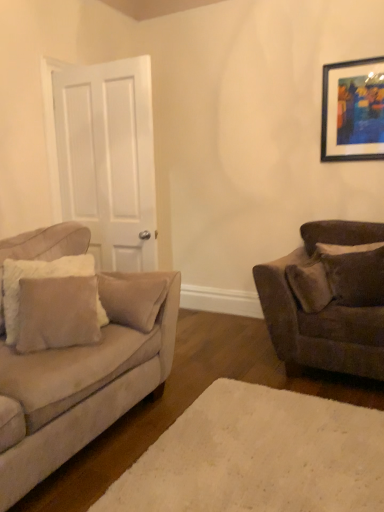
Question: Does suede beige couch at left, which is the first studio couch in left-to-right order, lie in front of velvet brown couch at right, marked as the 1th studio couch in a right-to-left arrangement?

Choices:
 (A) yes
 (B) no

Answer: (A)

Question: Does suede beige couch at left, positioned as the 2th studio couch in right-to-left order, come behind velvet brown couch at right, marked as the 1th studio couch in a right-to-left arrangement?

Choices:
 (A) no
 (B) yes

Answer: (A)

Question: Does suede beige couch at left, positioned as the 2th studio couch in right-to-left order, have a larger size compared to velvet brown couch at right, marked as the 1th studio couch in a right-to-left arrangement?

Choices:
 (A) yes
 (B) no

Answer: (A)

Question: Considering the relative sizes of suede beige couch at left, which is the first studio couch in left-to-right order, and velvet brown couch at right, the 2th studio couch from the left, in the image provided, is suede beige couch at left, which is the first studio couch in left-to-right order, shorter than velvet brown couch at right, the 2th studio couch from the left,?

Choices:
 (A) yes
 (B) no

Answer: (B)

Question: Does suede beige couch at left, positioned as the 2th studio couch in right-to-left order, have a lesser width compared to velvet brown couch at right, marked as the 1th studio couch in a right-to-left arrangement?

Choices:
 (A) no
 (B) yes

Answer: (A)

Question: From the image's perspective, would you say suede beige couch at left, which is the first studio couch in left-to-right order, is positioned over velvet brown couch at right, the 2th studio couch from the left?

Choices:
 (A) no
 (B) yes

Answer: (A)

Question: Is white matte door at left inside suede beige couch at left, positioned as the 2th studio couch in right-to-left order?

Choices:
 (A) yes
 (B) no

Answer: (B)

Question: Is suede beige couch at left, which is the first studio couch in left-to-right order, far away from white matte door at left?

Choices:
 (A) yes
 (B) no

Answer: (B)

Question: Considering the relative positions of suede beige couch at left, which is the first studio couch in left-to-right order, and white matte door at left in the image provided, is suede beige couch at left, which is the first studio couch in left-to-right order, to the left of white matte door at left from the viewer's perspective?

Choices:
 (A) yes
 (B) no

Answer: (A)

Question: From the image's perspective, is suede beige couch at left, positioned as the 2th studio couch in right-to-left order, on white matte door at left?

Choices:
 (A) yes
 (B) no

Answer: (B)

Question: Does suede beige couch at left, positioned as the 2th studio couch in right-to-left order, have a greater width compared to white matte door at left?

Choices:
 (A) no
 (B) yes

Answer: (B)

Question: Is suede beige couch at left, positioned as the 2th studio couch in right-to-left order, shorter than white matte door at left?

Choices:
 (A) no
 (B) yes

Answer: (B)

Question: Can you confirm if white plush rug at lower center is smaller than wooden-framed artwork at upper right?

Choices:
 (A) yes
 (B) no

Answer: (B)